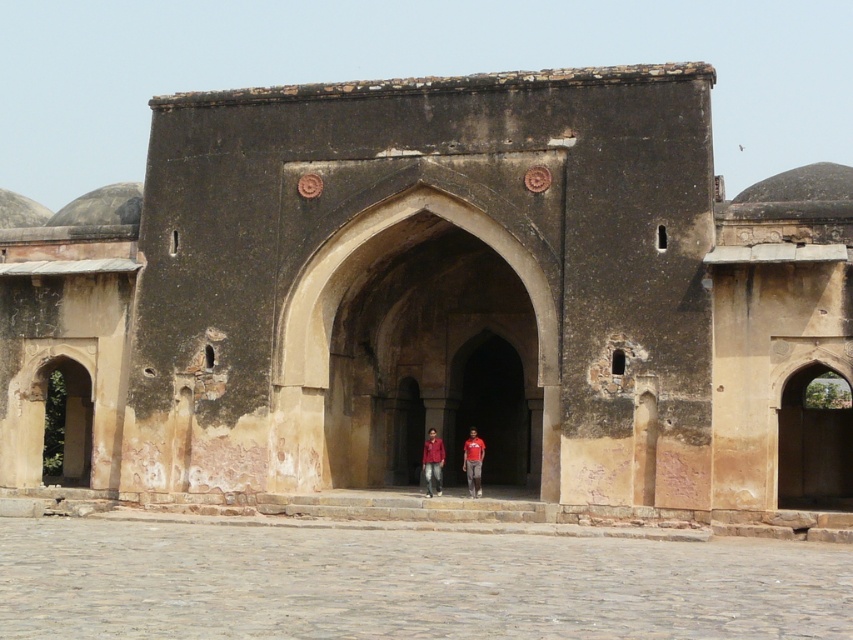
From the picture: Is matte red shirt at center above red shirt at center?

Indeed, matte red shirt at center is positioned over red shirt at center.

Which is behind, point (438, 477) or point (477, 483)?

The point (438, 477) is more distant.

Find the location of a particular element. This screenshot has height=640, width=853. matte red shirt at center is located at coordinates (432, 461).

Where is `matte red shirt at center`? Image resolution: width=853 pixels, height=640 pixels. matte red shirt at center is located at coordinates (432, 461).